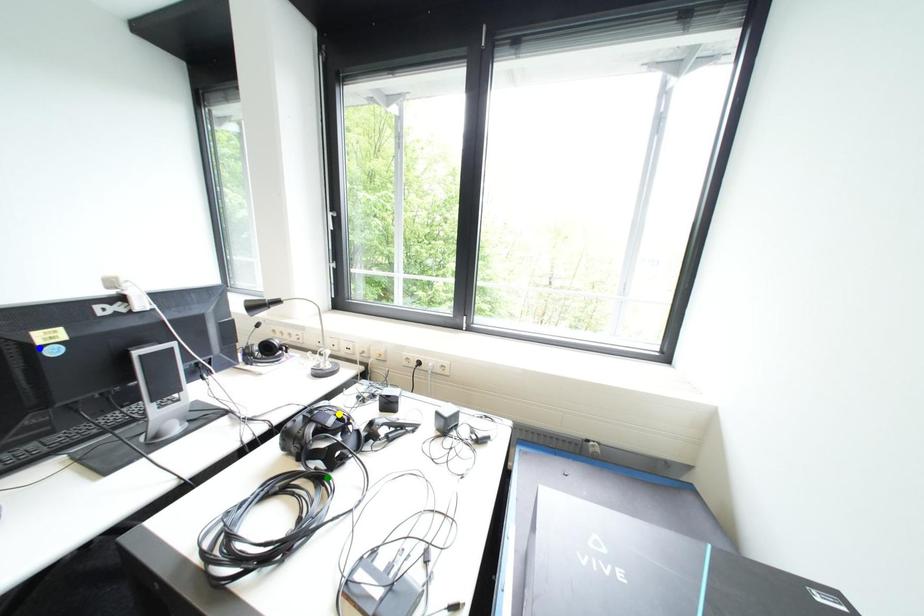
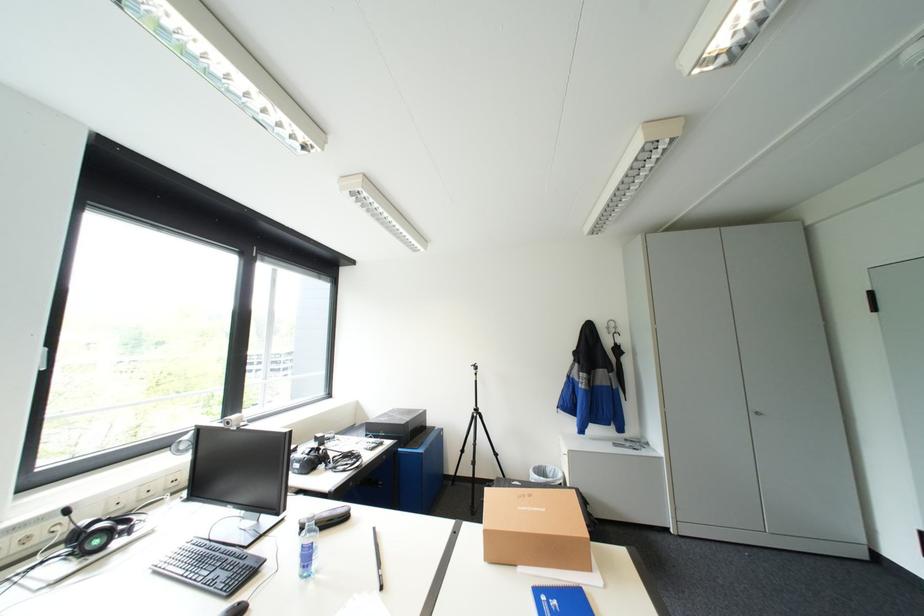
I am providing you with two images of the same scene from different viewpoints. Three points are marked in image1. Which point corresponds to a part or object that is occluded in image2?In image1, three points are marked. Which of them correspond to a part or object that is occluded in image2?Among the three points shown in image1, which one corresponds to a part or object that is no longer visible due to occlusion in image2?

Invisible in image2: blue point, yellow point, green point.